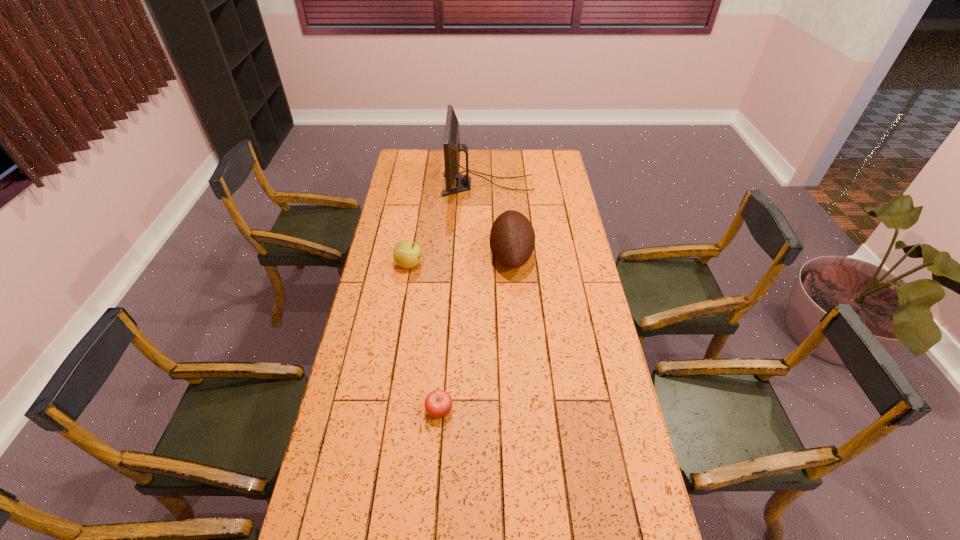
At what (x,y) coordinates should I click in order to perform the action: click on free spot that satisfies the following two spatial constraints: 1. on the logo side of the leftmost object; 2. on the back side of the nearest object. Please return your answer as a coordinate pair (x, y). The image size is (960, 540). Looking at the image, I should click on (384, 410).

Where is `free space that satisfies the following two spatial constraints: 1. on the logo side of the third tallest object; 2. on the back side of the nearest object`? This screenshot has width=960, height=540. free space that satisfies the following two spatial constraints: 1. on the logo side of the third tallest object; 2. on the back side of the nearest object is located at coordinates (384, 410).